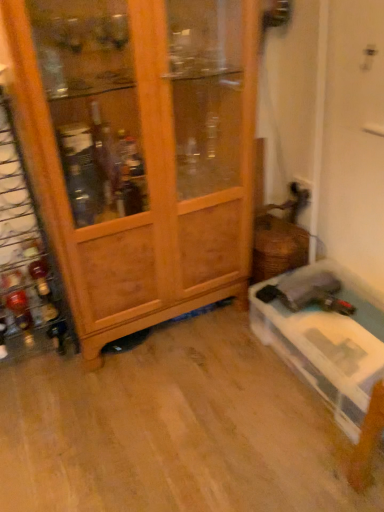
What are the coordinates of `wooden wine rack at left` in the screenshot? It's located at (x=27, y=250).

Describe the element at coordinates (17, 298) in the screenshot. The height and width of the screenshot is (512, 384). I see `translucent glass bottle at left, the second bottle when ordered from top to bottom` at that location.

What is the approximate height of shiny amber glass bottle at left, which is the second bottle from bottom to top?

The height of shiny amber glass bottle at left, which is the second bottle from bottom to top, is 6.75 centimeters.

What do you see at coordinates (37, 269) in the screenshot?
I see `shiny amber glass bottle at left, which is the second bottle from bottom to top` at bounding box center [37, 269].

Identify the location of wooden wine rack at left. (27, 250).

Considering the points (12, 307) and (29, 278), which point is in front, point (12, 307) or point (29, 278)?

The point (29, 278) is more forward.

This screenshot has width=384, height=512. Find the location of `shelf above the translucent glass bottle at left, the second bottle when ordered from top to bottom (from the image's perspective)`. shelf above the translucent glass bottle at left, the second bottle when ordered from top to bottom (from the image's perspective) is located at coordinates (27, 250).

Which of these two, translucent glass bottle at left, the 1th bottle positioned from the bottom, or wooden wine rack at left, is bigger?

wooden wine rack at left.

Is translucent glass bottle at left, the 1th bottle positioned from the bottom, facing towards wooden wine rack at left?

Yes, translucent glass bottle at left, the 1th bottle positioned from the bottom, is facing wooden wine rack at left.

Considering the relative sizes of wooden cabinet at left and wooden wine rack at left in the image provided, is wooden cabinet at left smaller than wooden wine rack at left?

Actually, wooden cabinet at left might be larger than wooden wine rack at left.

Is wooden cabinet at left turned away from wooden wine rack at left?

No, wooden cabinet at left is not facing away from wooden wine rack at left.

Considering their positions, is wooden cabinet at left located in front of or behind wooden wine rack at left?

wooden cabinet at left is in front of wooden wine rack at left.

Is wooden cabinet at left spatially inside wooden wine rack at left, or outside of it?

wooden cabinet at left is not inside wooden wine rack at left, it's outside.

Is wooden cabinet at left aimed at translucent glass bottle at left, the 1th bottle positioned from the bottom?

No, wooden cabinet at left is not turned towards translucent glass bottle at left, the 1th bottle positioned from the bottom.

From the image's perspective, which one is positioned lower, wooden cabinet at left or translucent glass bottle at left, the second bottle when ordered from top to bottom?

translucent glass bottle at left, the second bottle when ordered from top to bottom, appears lower in the image.

Which object is positioned more to the right, wooden cabinet at left or translucent glass bottle at left, the 1th bottle positioned from the bottom?

wooden cabinet at left is more to the right.

Is there a large distance between wooden cabinet at left and translucent glass bottle at left, the 1th bottle positioned from the bottom?

No, wooden cabinet at left is not far away from translucent glass bottle at left, the 1th bottle positioned from the bottom.

Are shiny amber glass bottle at left, which is the second bottle from bottom to top, and translucent glass bottle at left, the 1th bottle positioned from the bottom, far apart?

No, there isn't a large distance between shiny amber glass bottle at left, which is the second bottle from bottom to top, and translucent glass bottle at left, the 1th bottle positioned from the bottom.

Is shiny amber glass bottle at left, which is the second bottle from bottom to top, positioned beyond the bounds of translucent glass bottle at left, the second bottle when ordered from top to bottom?

Absolutely, shiny amber glass bottle at left, which is the second bottle from bottom to top, is external to translucent glass bottle at left, the second bottle when ordered from top to bottom.

Is shiny amber glass bottle at left, acting as the 1th bottle starting from the top, taller than translucent glass bottle at left, the second bottle when ordered from top to bottom?

Incorrect, the height of shiny amber glass bottle at left, acting as the 1th bottle starting from the top, is not larger of that of translucent glass bottle at left, the second bottle when ordered from top to bottom.

Does shiny amber glass bottle at left, which is the second bottle from bottom to top, have a larger size compared to wooden cabinet at left?

No, shiny amber glass bottle at left, which is the second bottle from bottom to top, is not bigger than wooden cabinet at left.

Can you tell me how much shiny amber glass bottle at left, acting as the 1th bottle starting from the top, and wooden cabinet at left differ in facing direction?

shiny amber glass bottle at left, acting as the 1th bottle starting from the top, and wooden cabinet at left are facing 1.21 degrees away from each other.

Considering the positions of point (35, 278) and point (26, 130), is point (35, 278) closer or farther from the camera than point (26, 130)?

Point (35, 278).

Which object is further away from the camera taking this photo, shiny amber glass bottle at left, acting as the 1th bottle starting from the top, or wooden cabinet at left?

shiny amber glass bottle at left, acting as the 1th bottle starting from the top, is behind.

Is translucent glass bottle at left, the 1th bottle positioned from the bottom, bigger or smaller than wooden cabinet at left?

Considering their sizes, translucent glass bottle at left, the 1th bottle positioned from the bottom, takes up less space than wooden cabinet at left.

Looking at this image, is translucent glass bottle at left, the second bottle when ordered from top to bottom, to the left of wooden cabinet at left from the viewer's perspective?

Indeed, translucent glass bottle at left, the second bottle when ordered from top to bottom, is positioned on the left side of wooden cabinet at left.

Does point (31, 325) come behind point (234, 237)?

Yes.

Between shiny amber glass bottle at left, acting as the 1th bottle starting from the top, and wooden wine rack at left, which one appears on the left side from the viewer's perspective?

wooden wine rack at left is more to the left.

Is shiny amber glass bottle at left, acting as the 1th bottle starting from the top, further to camera compared to wooden wine rack at left?

Yes.

From the image's perspective, is shiny amber glass bottle at left, which is the second bottle from bottom to top, positioned above or below wooden wine rack at left?

From the image's perspective, shiny amber glass bottle at left, which is the second bottle from bottom to top, appears below wooden wine rack at left.

The height and width of the screenshot is (512, 384). In order to click on the 2nd bottle located beneath the wooden wine rack at left (from a real-world perspective) in this screenshot , I will do `click(17, 298)`.

Locate an element on the screen. Image resolution: width=384 pixels, height=512 pixels. cupboard above the wooden wine rack at left (from a real-world perspective) is located at coordinates (139, 151).

Estimate the real-world distances between objects in this image. Which object is further from wooden cabinet at left, translucent glass bottle at left, the 1th bottle positioned from the bottom, or wooden wine rack at left?

translucent glass bottle at left, the 1th bottle positioned from the bottom, lies further to wooden cabinet at left than the other object.

From the image, which object appears to be farther from shiny amber glass bottle at left, which is the second bottle from bottom to top, wooden cabinet at left or wooden wine rack at left?

wooden cabinet at left lies further to shiny amber glass bottle at left, which is the second bottle from bottom to top, than the other object.

Looking at the image, which one is located closer to translucent glass bottle at left, the second bottle when ordered from top to bottom, wooden wine rack at left or wooden cabinet at left?

wooden wine rack at left is positioned closer to the anchor translucent glass bottle at left, the second bottle when ordered from top to bottom.

Considering their positions, is translucent glass bottle at left, the 1th bottle positioned from the bottom, positioned closer to wooden wine rack at left than wooden cabinet at left?

translucent glass bottle at left, the 1th bottle positioned from the bottom, is positioned closer to the anchor wooden wine rack at left.

Estimate the real-world distances between objects in this image. Which object is closer to wooden wine rack at left, shiny amber glass bottle at left, acting as the 1th bottle starting from the top, or wooden cabinet at left?

The object closer to wooden wine rack at left is shiny amber glass bottle at left, acting as the 1th bottle starting from the top.

Based on their spatial positions, is translucent glass bottle at left, the second bottle when ordered from top to bottom, or shiny amber glass bottle at left, acting as the 1th bottle starting from the top, closer to wooden cabinet at left?

Among the two, shiny amber glass bottle at left, acting as the 1th bottle starting from the top, is located nearer to wooden cabinet at left.

Looking at the image, which one is located further to shiny amber glass bottle at left, which is the second bottle from bottom to top, wooden cabinet at left or translucent glass bottle at left, the second bottle when ordered from top to bottom?

wooden cabinet at left is positioned further to the anchor shiny amber glass bottle at left, which is the second bottle from bottom to top.

Consider the image. Which object lies nearer to the anchor point shiny amber glass bottle at left, which is the second bottle from bottom to top, translucent glass bottle at left, the second bottle when ordered from top to bottom, or wooden cabinet at left?

Among the two, translucent glass bottle at left, the second bottle when ordered from top to bottom, is located nearer to shiny amber glass bottle at left, which is the second bottle from bottom to top.

The height and width of the screenshot is (512, 384). Identify the location of bottle between wooden cabinet at left and translucent glass bottle at left, the 1th bottle positioned from the bottom, along the z-axis. [x=37, y=269].

Where is `bottle between wooden wine rack at left and translucent glass bottle at left, the 1th bottle positioned from the bottom, from front to back`? The width and height of the screenshot is (384, 512). bottle between wooden wine rack at left and translucent glass bottle at left, the 1th bottle positioned from the bottom, from front to back is located at coordinates (37, 269).